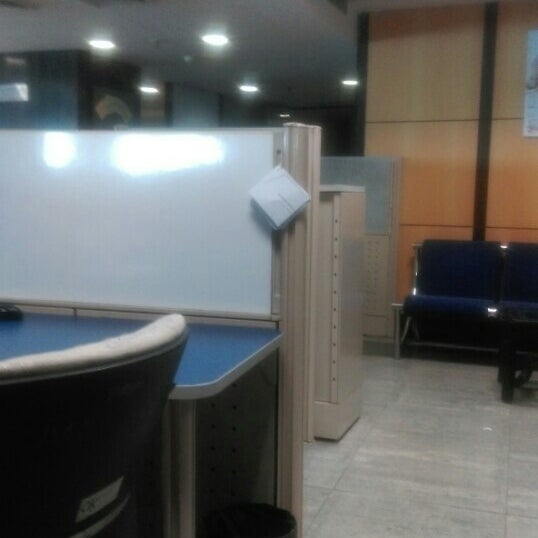
Identify the location of chair back. Image resolution: width=538 pixels, height=538 pixels. (94, 437).